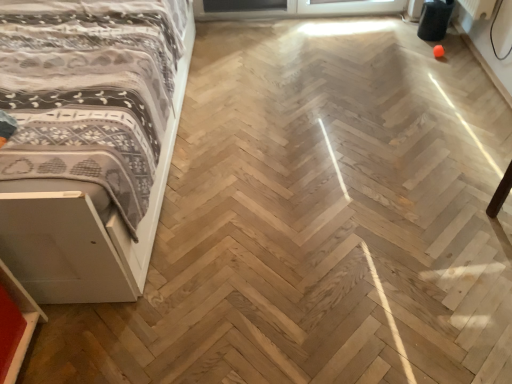
Question: Should I look upward or downward to see white matte bed at left?

Choices:
 (A) down
 (B) up

Answer: (B)